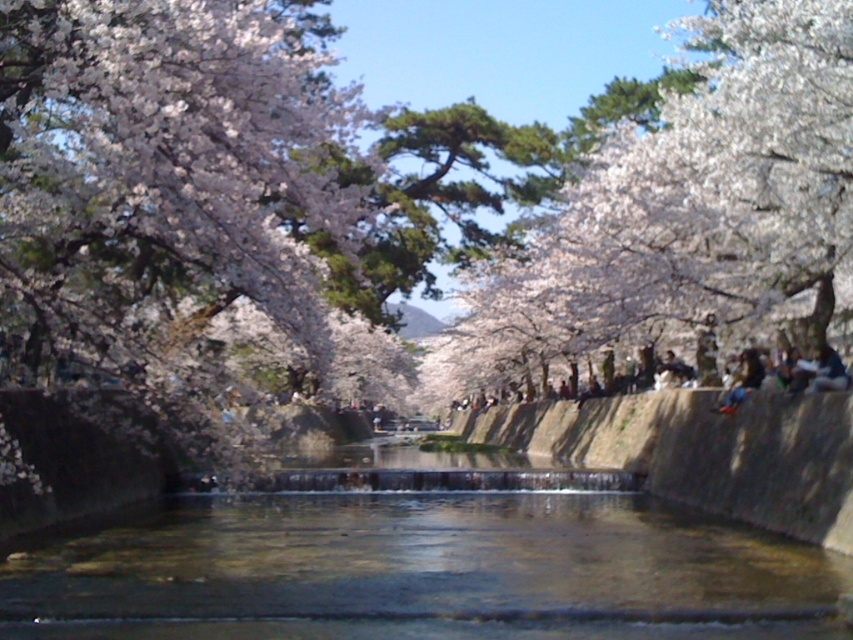
Is clear water at center positioned at the back of smooth concrete embankment at center?

No, it is in front of smooth concrete embankment at center.

Describe the element at coordinates (422, 572) in the screenshot. I see `clear water at center` at that location.

Does point (230, 499) come farther from viewer compared to point (816, 536)?

Yes, it is behind point (816, 536).

The image size is (853, 640). Identify the location of clear water at center. (422, 572).

Between clear water at center and white blossoms at upper center, which one is positioned lower?

Positioned lower is clear water at center.

Can you confirm if clear water at center is positioned to the left of white blossoms at upper center?

Correct, you'll find clear water at center to the left of white blossoms at upper center.

Which is behind, point (799, 627) or point (641, 234)?

Point (641, 234)

The image size is (853, 640). I want to click on clear water at center, so click(x=422, y=572).

The width and height of the screenshot is (853, 640). I want to click on white blossoming tree at upper left, so click(x=183, y=211).

At what (x,y) coordinates should I click in order to perform the action: click on white blossoming tree at upper left. Please return your answer as a coordinate pair (x, y). The image size is (853, 640). Looking at the image, I should click on (183, 211).